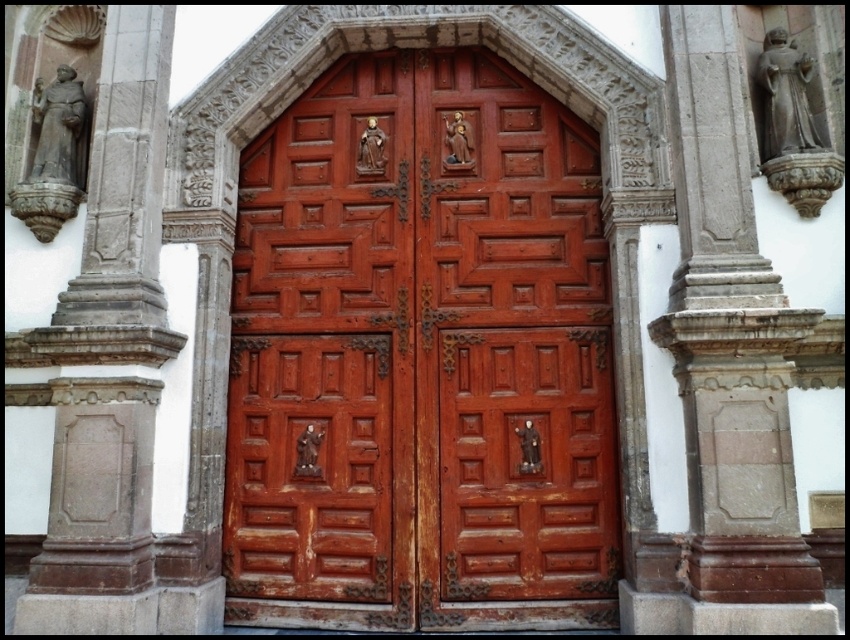
Based on the photo, is rustic wood door at center below gray stone statue at left?

Yes, rustic wood door at center is below gray stone statue at left.

Between point (343, 456) and point (146, 604), which one is positioned in front?

Point (146, 604) is in front.

Where is `rustic wood door at center`? rustic wood door at center is located at coordinates (421, 356).